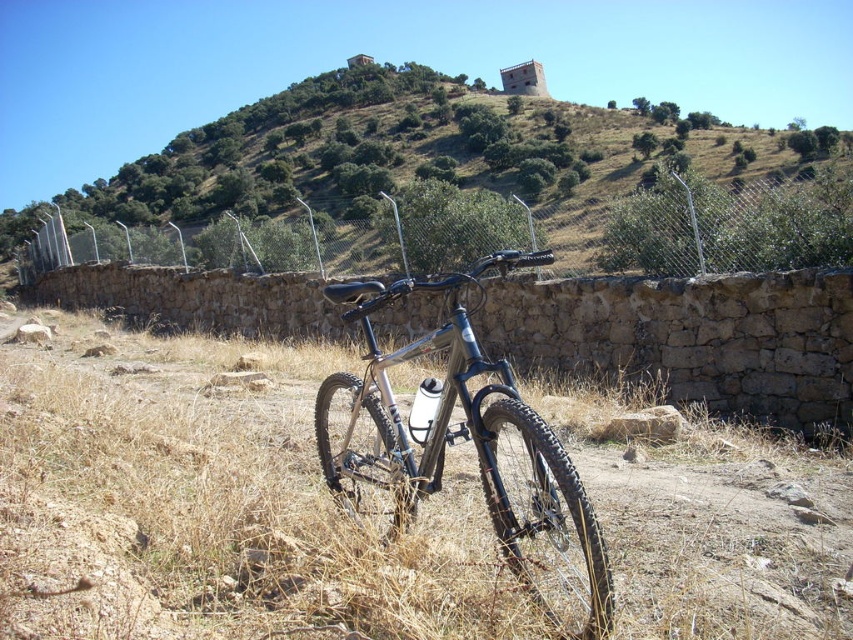
Is dry grass at center taller than green grassy hillside at center?

No.

Where is `dry grass at center`? dry grass at center is located at coordinates (222, 502).

Where is `green grassy hillside at center`? Image resolution: width=853 pixels, height=640 pixels. green grassy hillside at center is located at coordinates (454, 188).

Does green grassy hillside at center have a larger size compared to wire mesh fence at center?

Yes.

Is point (563, 236) positioned in front of point (463, 202)?

Yes, point (563, 236) is closer to viewer.

The width and height of the screenshot is (853, 640). I want to click on green grassy hillside at center, so click(454, 188).

In the scene shown: Is green grassy hillside at center to the right of shiny metallic bicycle at center from the viewer's perspective?

In fact, green grassy hillside at center is to the left of shiny metallic bicycle at center.

The image size is (853, 640). Find the location of `green grassy hillside at center`. green grassy hillside at center is located at coordinates (454, 188).